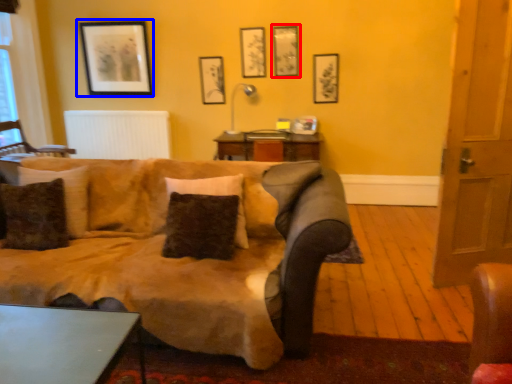
Question: Which point is closer to the camera, picture frame (highlighted by a red box) or picture frame (highlighted by a blue box)?

Choices:
 (A) picture frame
 (B) picture frame

Answer: (A)